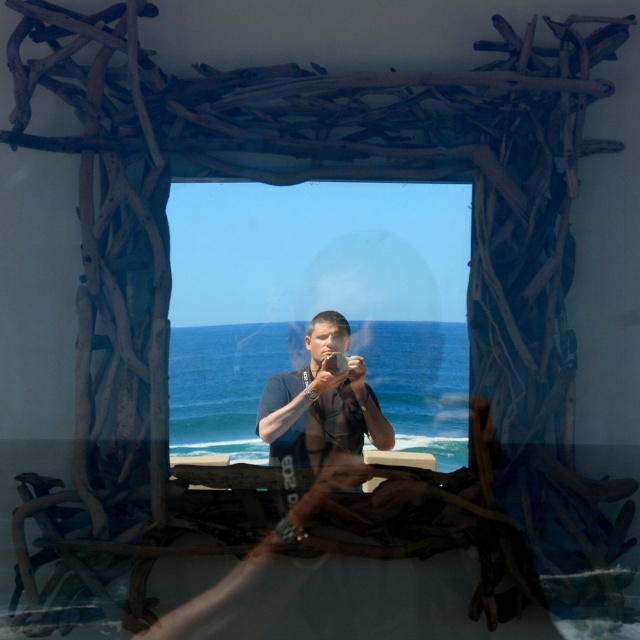
You are standing in a room with a wooden archway structure. You see a point at coordinates (317,301). Is this point located on the wooden archway structure or on the transparent glass window behind it?

The point at coordinates (317,301) is on the transparent glass window at center, so it is not on the wooden archway structure.

From the picture: You are a photographer trying to capture the ocean view through the wooden archway. You notice the dark blue fabric at center and the transparent glass window at center in your frame. Which object should you adjust to ensure the ocean is clearly visible?

You should adjust the dark blue fabric at center because it is positioned behind the transparent glass window at center, which might block the view of the ocean.